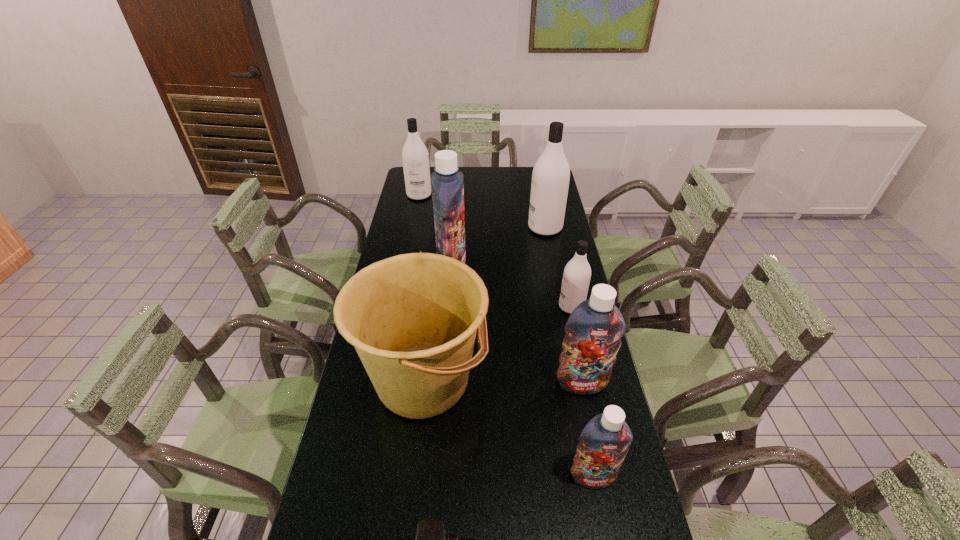
Point out which blue shampoo is positioned as the nearest to the third farthest object. Please provide its 2D coordinates. Your answer should be formatted as a tuple, i.e. [(x, y)], where the tuple contains the x and y coordinates of a point satisfying the conditions above.

[(594, 329)]

Where is `vacant space that satisfies the following two spatial constraints: 1. on the front-facing side of the biggest white shampoo; 2. on the front label of the smallest blue shampoo`? The width and height of the screenshot is (960, 540). vacant space that satisfies the following two spatial constraints: 1. on the front-facing side of the biggest white shampoo; 2. on the front label of the smallest blue shampoo is located at coordinates (593, 476).

Locate an element on the screen. This screenshot has width=960, height=540. blank area in the image that satisfies the following two spatial constraints: 1. on the front-facing side of the second nearest white shampoo; 2. on the front label of the nearest blue shampoo is located at coordinates (593, 476).

Find the location of a particular element. vacant position in the image that satisfies the following two spatial constraints: 1. on the front-facing side of the fifth nearest object; 2. on the front label of the second nearest shampoo is located at coordinates (588, 383).